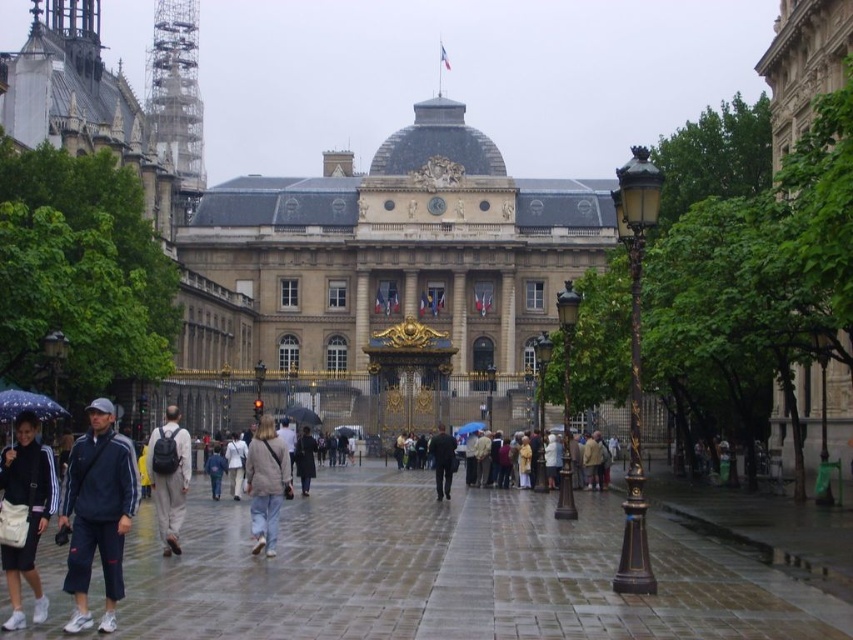
Which is below, dark blue fabric jacket at left or transparent plastic umbrella at center?

dark blue fabric jacket at left is below.

Is point (96, 428) positioned in front of point (311, 422)?

Yes, point (96, 428) is closer to viewer.

Who is more forward, (59, 515) or (308, 426)?

Point (59, 515)

Find the location of a particular element. This screenshot has height=640, width=853. dark blue fabric jacket at left is located at coordinates (97, 513).

Is light gray backpack at center shorter than transparent plastic umbrella at center?

In fact, light gray backpack at center may be taller than transparent plastic umbrella at center.

Between point (158, 513) and point (293, 412), which one is positioned in front?

Point (158, 513) is in front.

Locate an element on the screen. This screenshot has height=640, width=853. light gray backpack at center is located at coordinates (169, 476).

Is point (12, 392) closer to camera compared to point (239, 440)?

Yes, it is.

Which of these two, transparent plastic umbrella at lower left or light beige jacket at center, stands shorter?

Standing shorter between the two is light beige jacket at center.

Who is more distant from viewer, (4, 417) or (239, 454)?

Point (239, 454)

Image resolution: width=853 pixels, height=640 pixels. I want to click on transparent plastic umbrella at lower left, so click(x=27, y=404).